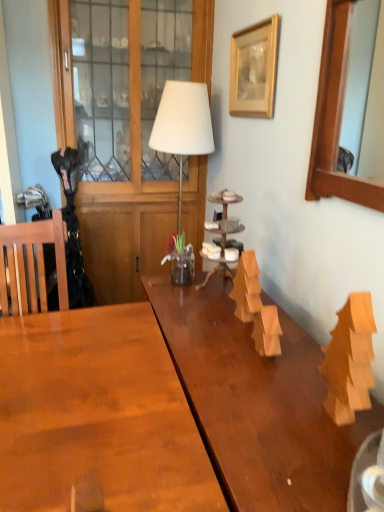
Question: From the image's perspective, does wooden picture frame at upper center, which appears as the 2th picture frame when viewed from the right, appear higher than wooden mirror at upper right, arranged as the 1th picture frame when viewed from the front?

Choices:
 (A) no
 (B) yes

Answer: (B)

Question: Is wooden picture frame at upper center, the second picture frame in the front-to-back sequence, at the left side of wooden mirror at upper right, arranged as the 1th picture frame when viewed from the front?

Choices:
 (A) yes
 (B) no

Answer: (A)

Question: Does wooden picture frame at upper center, marked as the first picture frame in a back-to-front arrangement, have a lesser width compared to wooden mirror at upper right, the 2th picture frame when ordered from left to right?

Choices:
 (A) yes
 (B) no

Answer: (A)

Question: Does wooden picture frame at upper center, the second picture frame in the front-to-back sequence, come behind wooden mirror at upper right, arranged as the 1th picture frame when viewed from the front?

Choices:
 (A) no
 (B) yes

Answer: (B)

Question: Can you confirm if wooden picture frame at upper center, which is the first picture frame in left-to-right order, is smaller than wooden mirror at upper right, the 1th picture frame when ordered from right to left?

Choices:
 (A) no
 (B) yes

Answer: (B)

Question: Could you tell me if wooden picture frame at upper center, marked as the first picture frame in a back-to-front arrangement, is facing wooden mirror at upper right, the 2th picture frame when ordered from left to right?

Choices:
 (A) no
 (B) yes

Answer: (A)

Question: From a real-world perspective, is white matte table lamp at center over wooden picture frame at upper center, which is the first picture frame in left-to-right order?

Choices:
 (A) yes
 (B) no

Answer: (B)

Question: From the image's perspective, is white matte table lamp at center above wooden picture frame at upper center, marked as the first picture frame in a back-to-front arrangement?

Choices:
 (A) yes
 (B) no

Answer: (B)

Question: Is white matte table lamp at center behind wooden picture frame at upper center, marked as the first picture frame in a back-to-front arrangement?

Choices:
 (A) yes
 (B) no

Answer: (A)

Question: Is white matte table lamp at center at the right side of wooden picture frame at upper center, which appears as the 2th picture frame when viewed from the right?

Choices:
 (A) no
 (B) yes

Answer: (A)

Question: Is white matte table lamp at center located outside wooden picture frame at upper center, which is the first picture frame in left-to-right order?

Choices:
 (A) yes
 (B) no

Answer: (A)

Question: From the image's perspective, would you say white matte table lamp at center is shown under wooden picture frame at upper center, marked as the first picture frame in a back-to-front arrangement?

Choices:
 (A) no
 (B) yes

Answer: (B)

Question: From a real-world perspective, is white matte table lamp at center below wooden mirror at upper right, arranged as the 1th picture frame when viewed from the front?

Choices:
 (A) yes
 (B) no

Answer: (A)